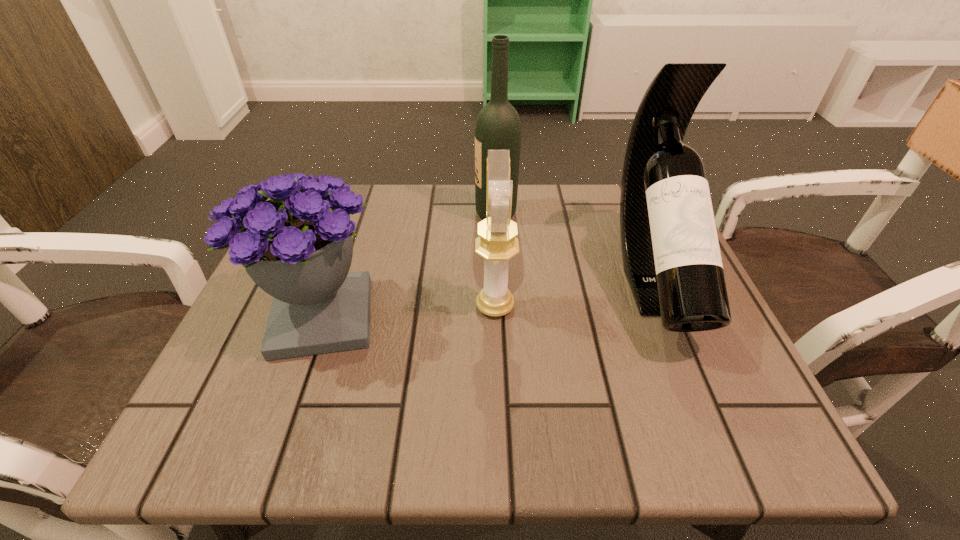
Identify the location of vacant space at the near right corner of the desktop. (660, 416).

At what (x,y) coordinates should I click in order to perform the action: click on empty space between the left wine bottle and the right wine bottle. Please return your answer as a coordinate pair (x, y). The width and height of the screenshot is (960, 540). Looking at the image, I should click on (574, 246).

Where is `empty space that is in between the award and the bouquet`? The image size is (960, 540). empty space that is in between the award and the bouquet is located at coordinates (409, 312).

Image resolution: width=960 pixels, height=540 pixels. I want to click on empty space between the rightmost object and the award, so (574, 293).

You are a GUI agent. You are given a task and a screenshot of the screen. Output one action in this format:
    pyautogui.click(x=<x>, y=<y>)
    Task: Click on the free space between the leftmost object and the left wine bottle
    The height and width of the screenshot is (540, 960).
    Given the screenshot: What is the action you would take?
    pyautogui.click(x=409, y=266)

The height and width of the screenshot is (540, 960). I want to click on vacant area between the leftmost object and the award, so click(409, 312).

I want to click on unoccupied area between the left wine bottle and the leftmost object, so click(x=409, y=266).

This screenshot has height=540, width=960. I want to click on vacant area between the award and the bouquet, so click(409, 312).

Identify which object is located as the second nearest to the left wine bottle. Please provide its 2D coordinates. Your answer should be formatted as a tuple, i.e. [(x, y)], where the tuple contains the x and y coordinates of a point satisfying the conditions above.

[(671, 257)]

I want to click on object that stands as the second closest to the rightmost object, so click(497, 243).